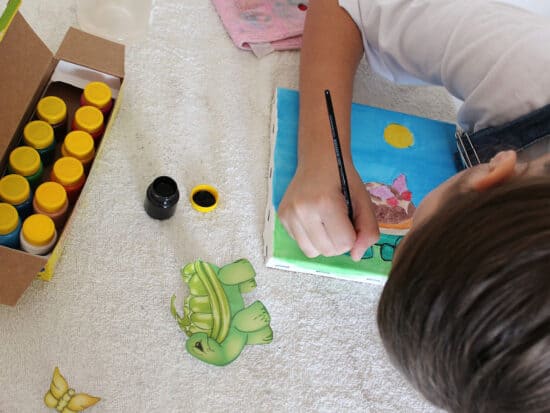
Where is `white carpet`? The height and width of the screenshot is (413, 550). white carpet is located at coordinates (112, 354), (160, 62), (328, 375).